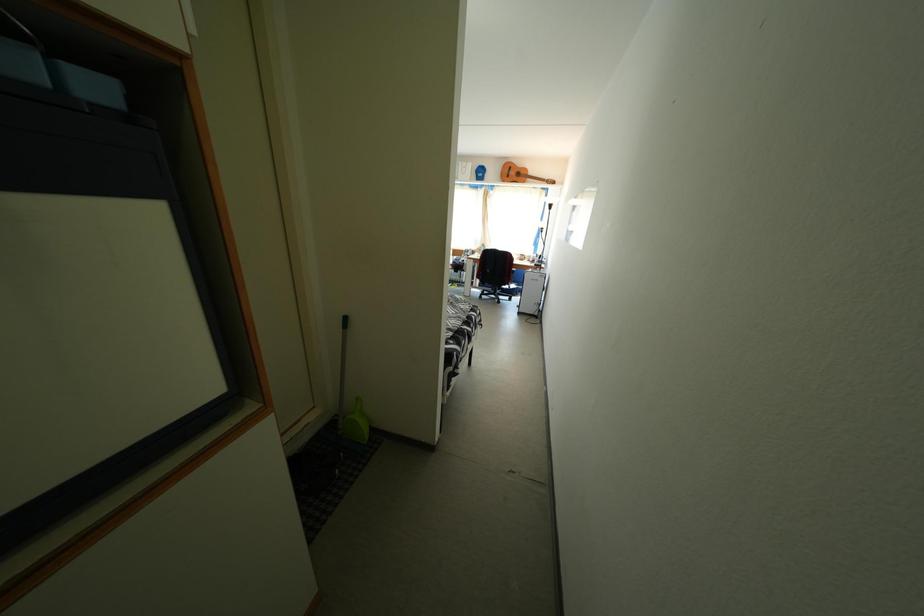
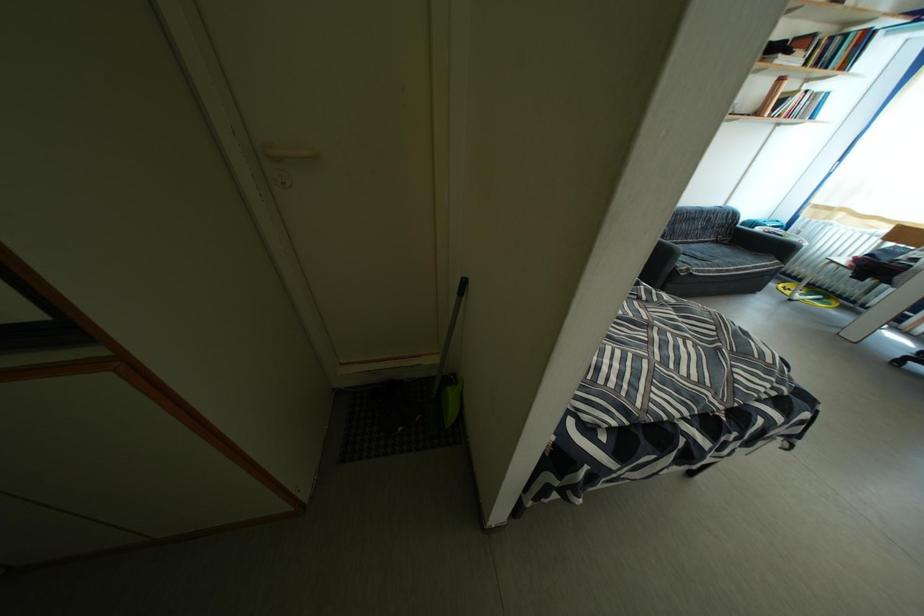
How did the camera likely rotate?

The camera's rotation is toward left-down.